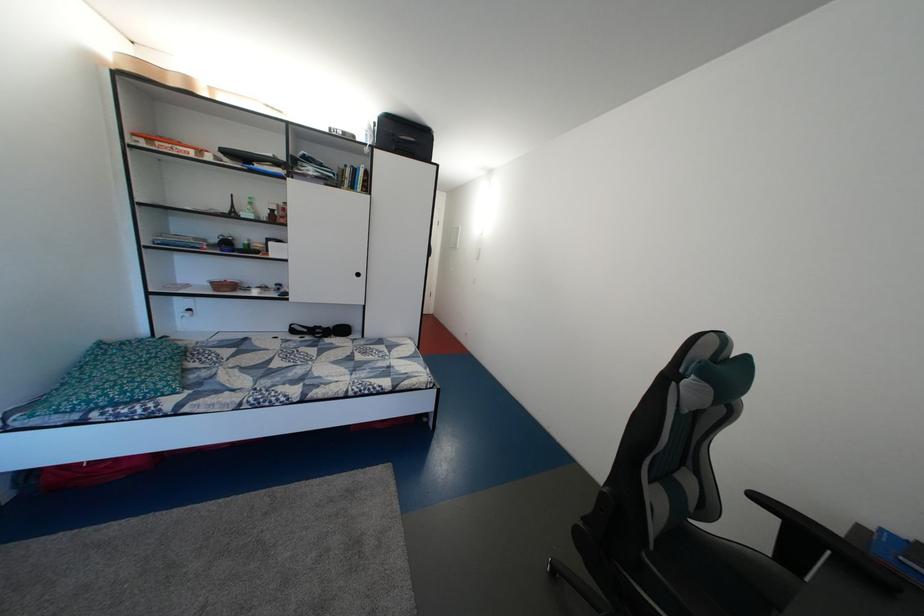
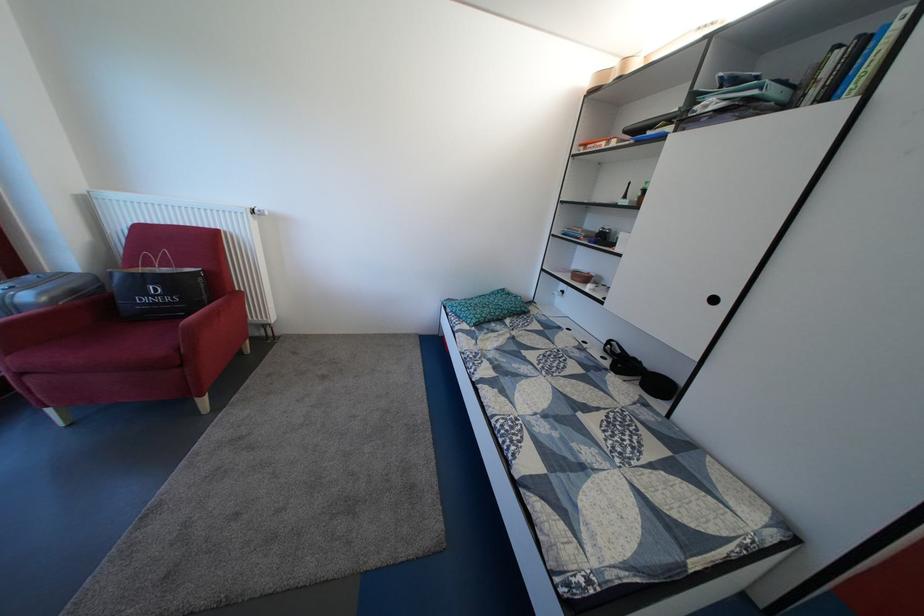
In the second image, find the point that corresponds to pixel 201 317 in the first image.

(574, 299)